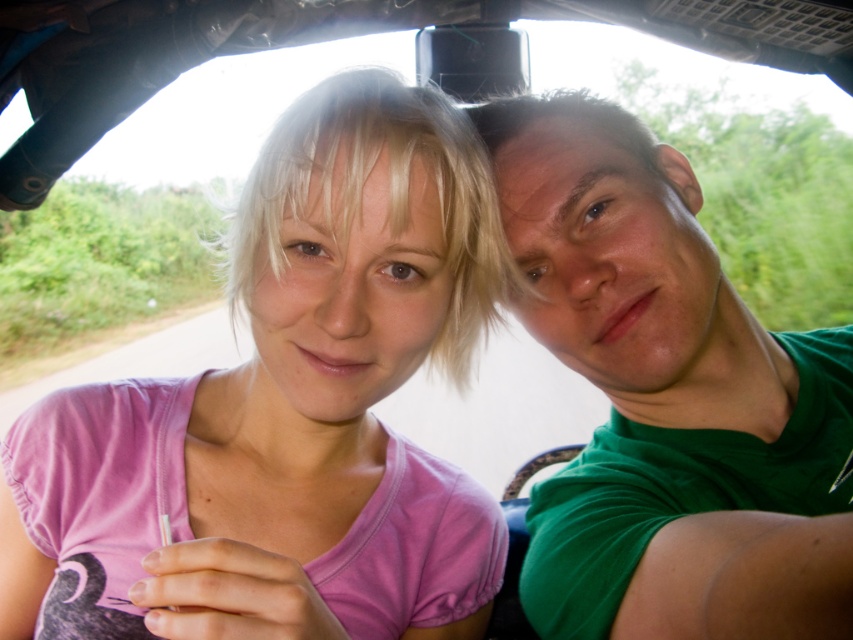
Does pink fabric shirt at center have a greater width compared to green matte shirt at right?

In fact, pink fabric shirt at center might be narrower than green matte shirt at right.

Where is `pink fabric shirt at center`? pink fabric shirt at center is located at coordinates (286, 408).

Where is `pink fabric shirt at center`? This screenshot has height=640, width=853. pink fabric shirt at center is located at coordinates (286, 408).